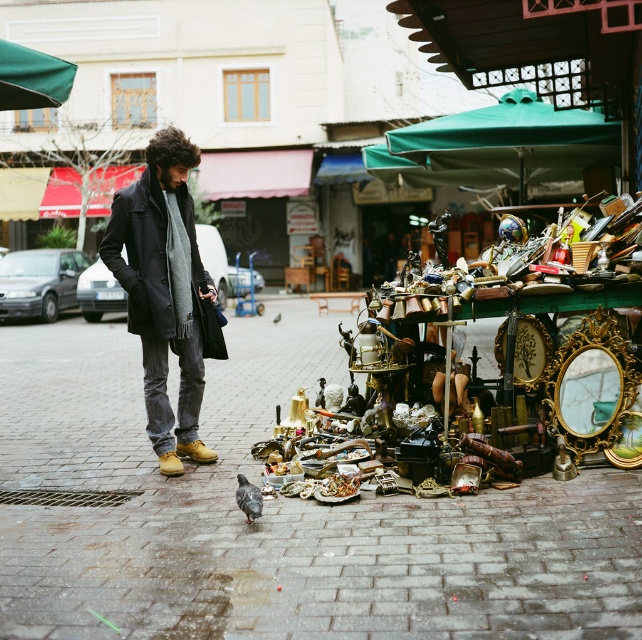
Question: Is brick pavement at center behind dark wool coat at center?

Choices:
 (A) yes
 (B) no

Answer: (B)

Question: Which point is farther to the camera?

Choices:
 (A) brick pavement at center
 (B) dark wool coat at center

Answer: (B)

Question: Among these objects, which one is farthest from the camera?

Choices:
 (A) dark wool coat at center
 (B) brick pavement at center

Answer: (A)

Question: Does brick pavement at center appear over dark wool coat at center?

Choices:
 (A) no
 (B) yes

Answer: (A)

Question: Does brick pavement at center come in front of dark wool coat at center?

Choices:
 (A) yes
 (B) no

Answer: (A)